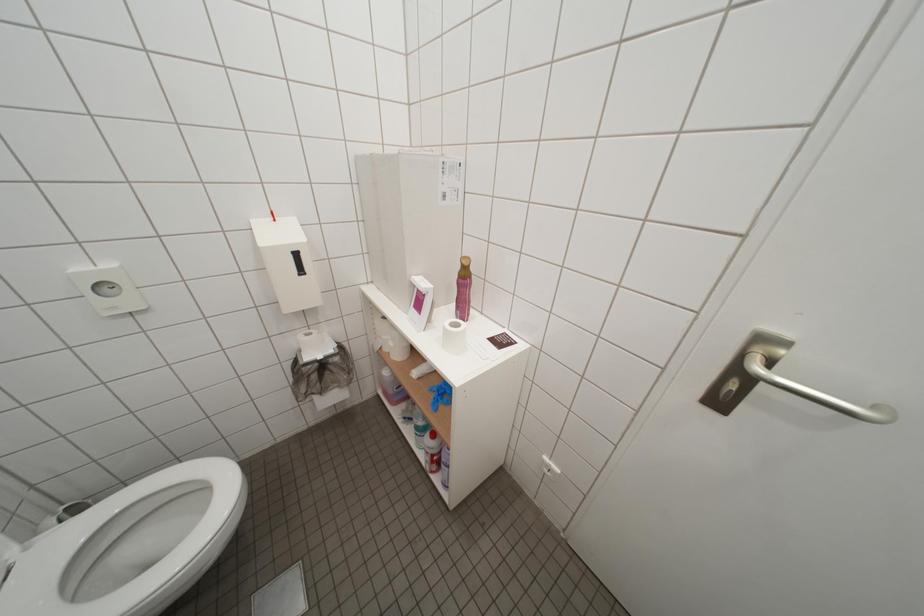
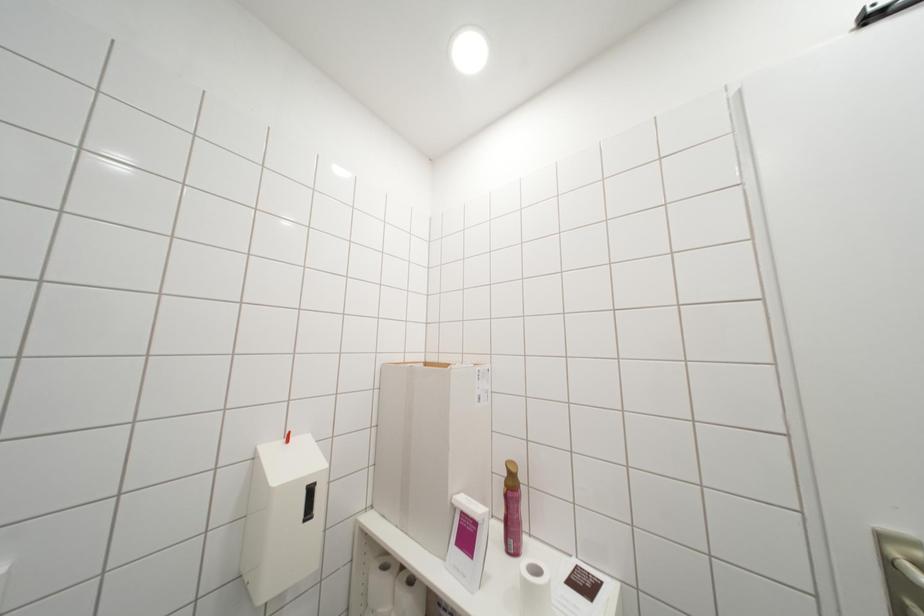
The first image is from the beginning of the video and the second image is from the end. How did the camera likely rotate when shooting the video?

The camera rotated toward right-up.